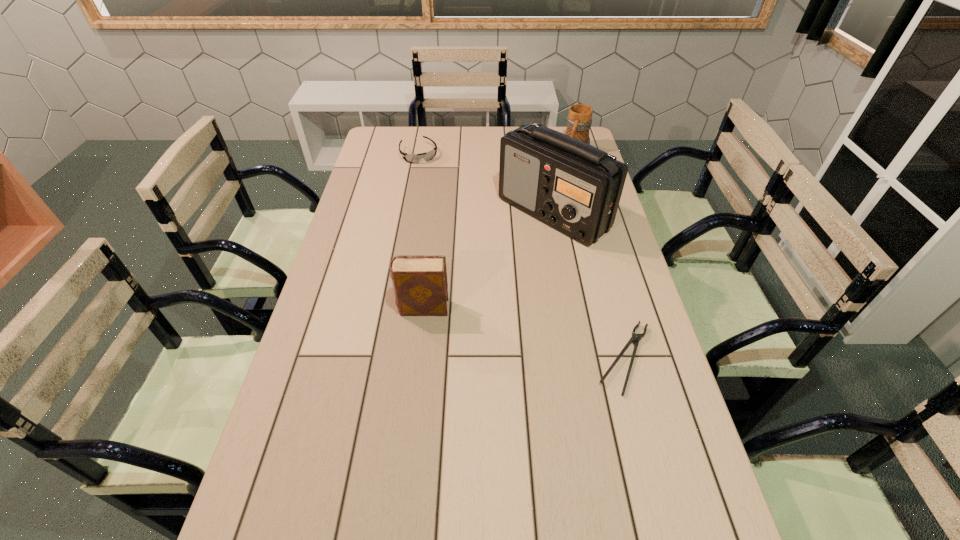
Where is `mug that is at the far edge`? mug that is at the far edge is located at coordinates (579, 120).

The image size is (960, 540). Find the location of `sunglasses at the far edge`. sunglasses at the far edge is located at coordinates (427, 156).

Identify the location of object that is positioned at the left edge. (427, 156).

The height and width of the screenshot is (540, 960). Find the location of `tongs that is at the right edge`. tongs that is at the right edge is located at coordinates (635, 338).

Where is `radio receiver at the right edge`? This screenshot has height=540, width=960. radio receiver at the right edge is located at coordinates (574, 187).

Image resolution: width=960 pixels, height=540 pixels. I want to click on mug positioned at the right edge, so click(579, 120).

Image resolution: width=960 pixels, height=540 pixels. Identify the location of object that is at the far left corner. (427, 156).

Locate an element on the screen. The height and width of the screenshot is (540, 960). object that is at the far right corner is located at coordinates (579, 120).

Where is `vacant area at the far edge`? This screenshot has height=540, width=960. vacant area at the far edge is located at coordinates pos(466,146).

You are a GUI agent. You are given a task and a screenshot of the screen. Output one action in this format:
    pyautogui.click(x=<x>, y=<y>)
    Task: Click on the vacant space at the near edge of the desktop
    This screenshot has width=960, height=540.
    Given the screenshot: What is the action you would take?
    pyautogui.click(x=394, y=525)